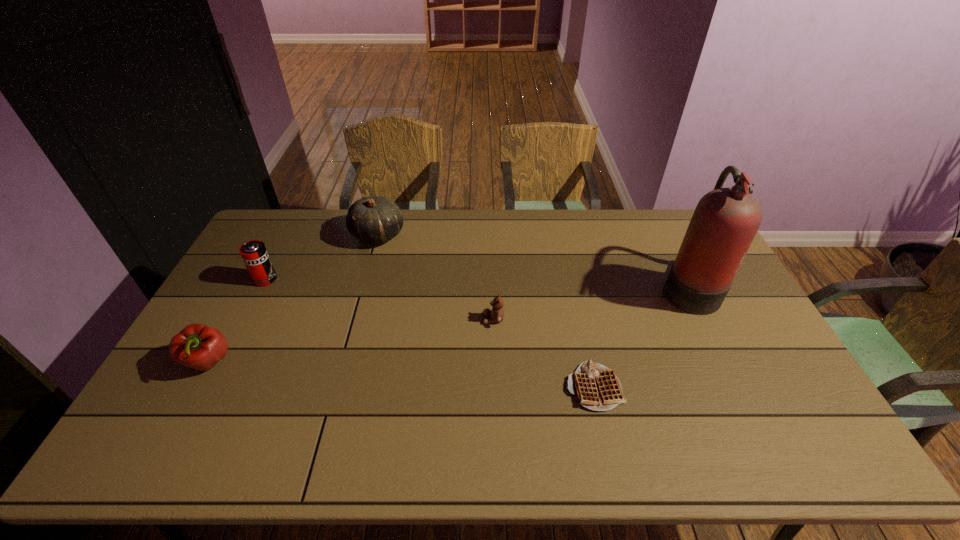
This screenshot has width=960, height=540. Find the location of `fire extinguisher`. fire extinguisher is located at coordinates (726, 220).

Image resolution: width=960 pixels, height=540 pixels. I want to click on the tallest object, so click(x=726, y=220).

Find the location of a particular element. the fourth object from right to left is located at coordinates (373, 219).

Where is `the farthest object`? the farthest object is located at coordinates (373, 219).

At what (x,y) coordinates should I click in order to perform the action: click on can. Please return your answer as a coordinate pair (x, y). Looking at the image, I should click on (254, 253).

Identify the location of bell pepper. (197, 346).

Where is `the fourth object from left to right`? the fourth object from left to right is located at coordinates (496, 314).

At what (x,y) coordinates should I click in order to perform the action: click on the second shortest object. Please return your answer as a coordinate pair (x, y). The height and width of the screenshot is (540, 960). Looking at the image, I should click on (496, 314).

Find the location of a particular element. The image size is (960, 540). waffle is located at coordinates (596, 387).

Where is `the second object from right to left`? The height and width of the screenshot is (540, 960). the second object from right to left is located at coordinates (596, 387).